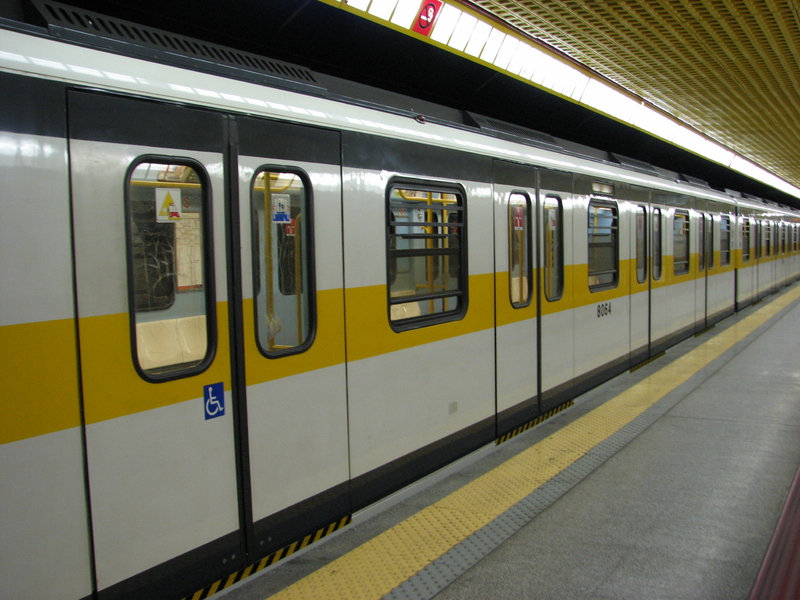
This screenshot has height=600, width=800. Find the location of `floor`. floor is located at coordinates (661, 518).